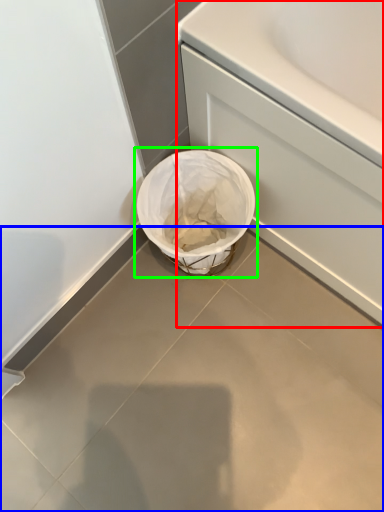
Question: Based on their relative distances, which object is farther from bath (highlighted by a red box)? Choose from concrete (highlighted by a blue box) and waste container (highlighted by a green box).

Choices:
 (A) concrete
 (B) waste container

Answer: (A)